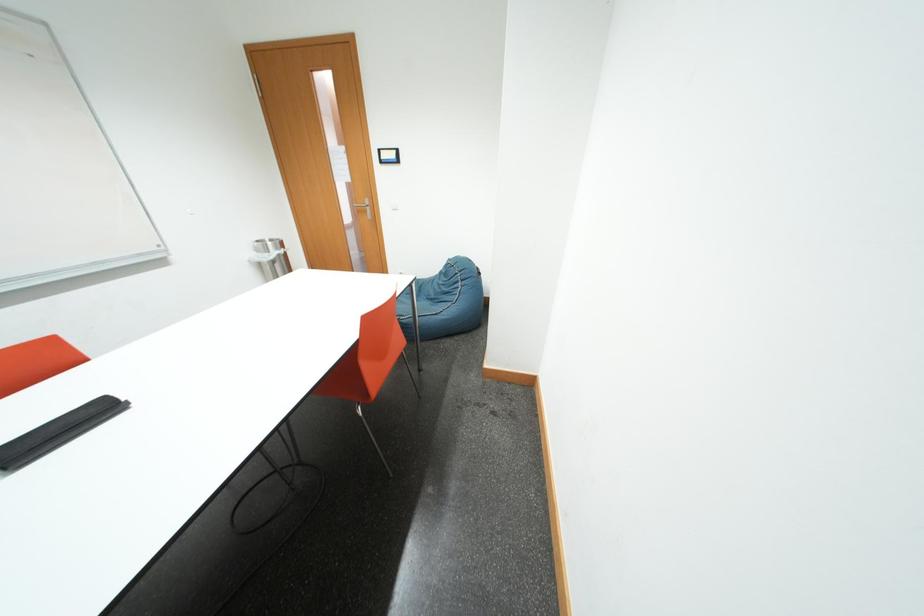
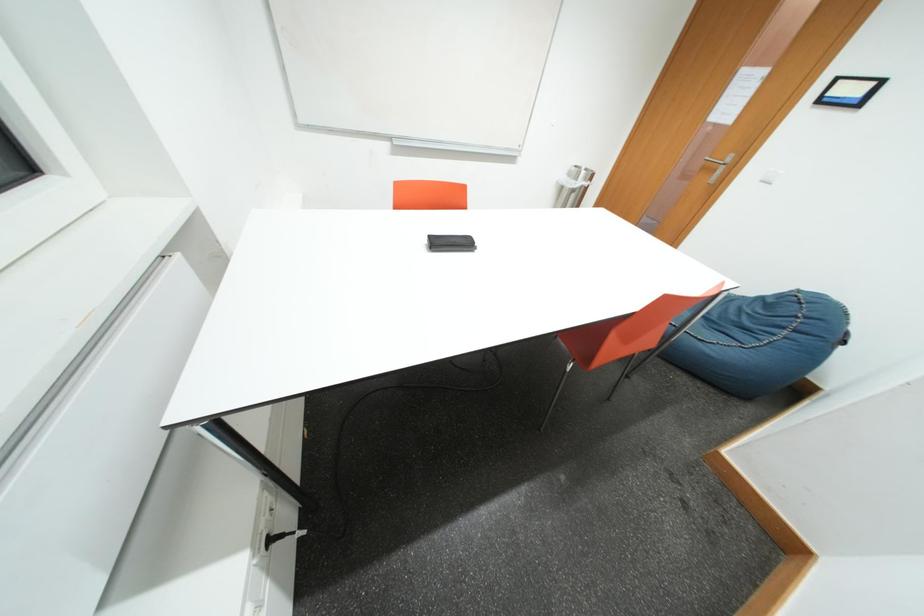
The first image is from the beginning of the video and the second image is from the end. How did the camera likely rotate when shooting the video?

The camera rotated toward left-down.